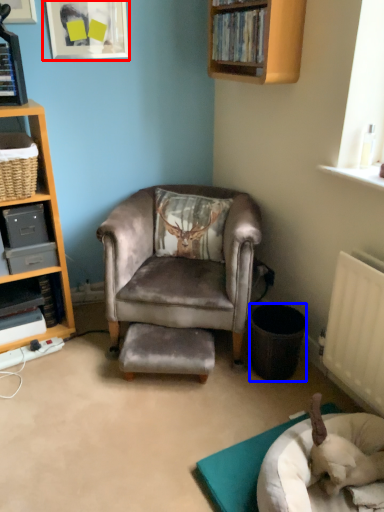
Question: Which object appears closest to the camera in this image, picture frame (highlighted by a red box) or trash bin/can (highlighted by a blue box)?

Choices:
 (A) picture frame
 (B) trash bin/can

Answer: (B)